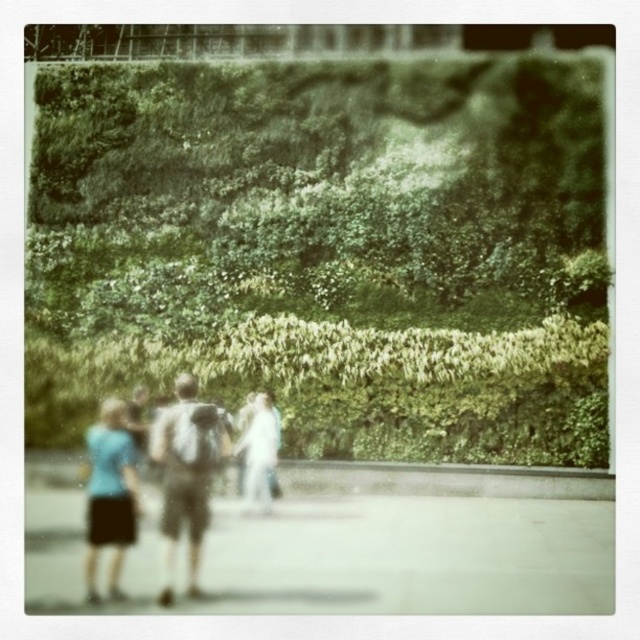
You are a photographer trying to capture a photo of the gray fabric backpack at center while ensuring the green leafy hedge at upper center is in the background. Based on the scene description, will the hedge appear blurred or sharp in the photo?

The green leafy hedge at upper center is further to the viewer than gray fabric backpack at center. Since the backpack is closer to the camera and the hedge is farther away, the hedge will likely appear blurred in the photo if the backpack is in focus.

You are standing in the scene and want to move from the point at coordinates point [509,257] to the point at coordinates point [125,508]. Which direction should you move relative to the other point?

To move from point [509,257] to point [125,508], you should move towards the lower right direction since point [509,257] is behind point [125,508].